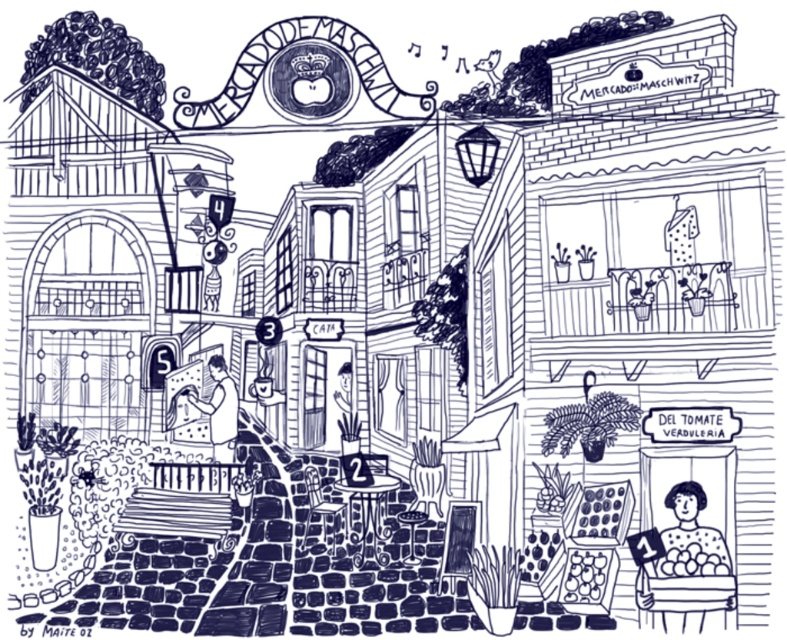
Question: Can you confirm if polka dot dress at lower right is bigger than smooth black shirt at center?

Choices:
 (A) yes
 (B) no

Answer: (A)

Question: Considering the relative positions of polka dot dress at lower right and smooth black shirt at center in the image provided, where is polka dot dress at lower right located with respect to smooth black shirt at center?

Choices:
 (A) below
 (B) above

Answer: (A)

Question: Does polka dot dress at lower right have a larger size compared to smooth black shirt at center?

Choices:
 (A) yes
 (B) no

Answer: (A)